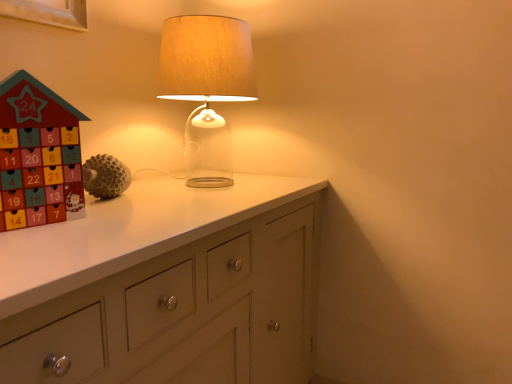
Question: Is translucent glass lamp at center taller or shorter than wooden advent calendar at left?

Choices:
 (A) short
 (B) tall

Answer: (B)

Question: Is translucent glass lamp at center in front of or behind wooden advent calendar at left in the image?

Choices:
 (A) behind
 (B) front

Answer: (A)

Question: Looking at their shapes, would you say translucent glass lamp at center is wider or thinner than wooden advent calendar at left?

Choices:
 (A) wide
 (B) thin

Answer: (A)

Question: Is wooden advent calendar at left to the left or to the right of translucent glass lamp at center in the image?

Choices:
 (A) left
 (B) right

Answer: (A)

Question: From the image's perspective, is wooden advent calendar at left located above or below translucent glass lamp at center?

Choices:
 (A) above
 (B) below

Answer: (B)

Question: In terms of height, does wooden advent calendar at left look taller or shorter compared to translucent glass lamp at center?

Choices:
 (A) tall
 (B) short

Answer: (B)

Question: Considering the positions of wooden advent calendar at left and translucent glass lamp at center in the image, is wooden advent calendar at left wider or thinner than translucent glass lamp at center?

Choices:
 (A) thin
 (B) wide

Answer: (A)